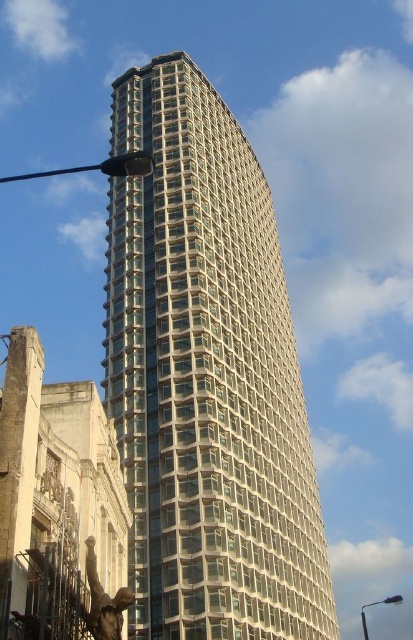
You are standing in front of the modern architectural structure and want to take a photo of the clear glass building at center. However, there is a black metal pole at left blocking your view. Based on the scene description, can you determine if the pole is positioned to the left or right of the building?

The clear glass building at center is to the right of the black metal pole at left, meaning the pole is positioned to the left of the building. Therefore, the black metal pole at left is blocking the view from the left side of the building.

You are standing at the center of the image. Where is the clear glass building at center located relative to your position?

The clear glass building at center is located at point (206, 378) relative to the center of the image.

You are a delivery drone that is 3 feet wide. You need to fly between the clear glass building at center and the black metal pole at left. Can you fit through the space between them?

The clear glass building at center and the black metal pole at left are 73.05 feet apart from each other, so yes, the drone can fit through the space between them since the distance is much wider than the drone.